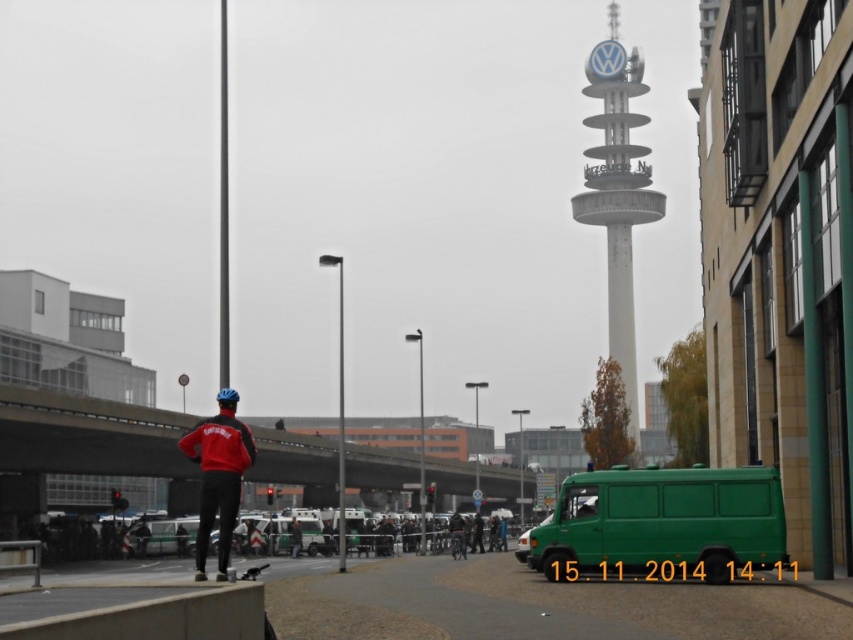
You are a delivery person arriving at the scene. You need to park your green matte van at lower right and place your dark blue helmet at center. Given the space constraints, can you fit both the van and the helmet side by side along the pathway?

The green matte van at lower right is wider than the dark blue helmet at center, so both can fit side by side along the pathway as long as there is enough space for the van.

You are a delivery person standing at the concrete bridge at center and need to reach the red matte jacket at lower left to deliver a package. Can you walk directly to the jacket without going around any obstacles?

The concrete bridge at center and red matte jacket at lower left are 22.36 meters apart. Since there are no obstacles mentioned in the scene description between them, you can walk directly to the jacket.